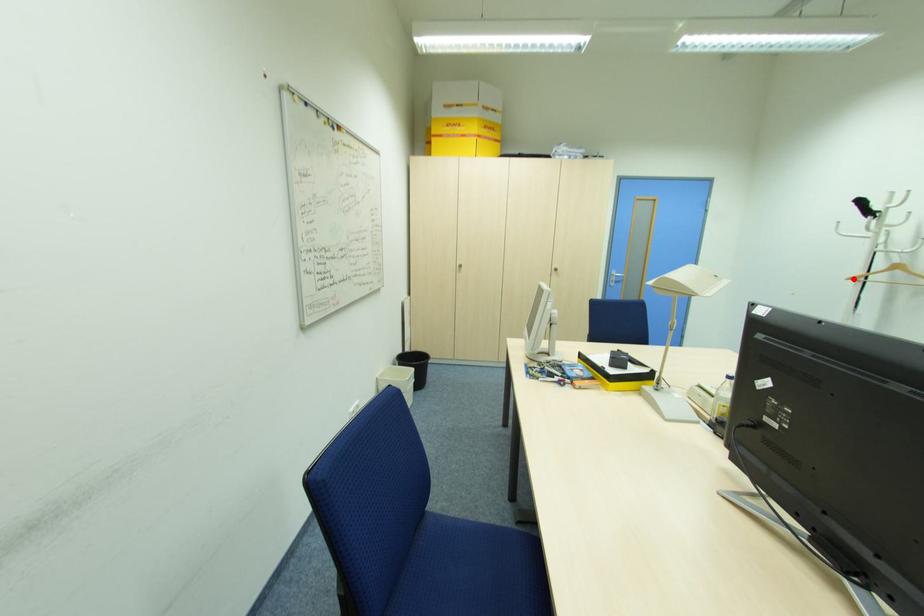
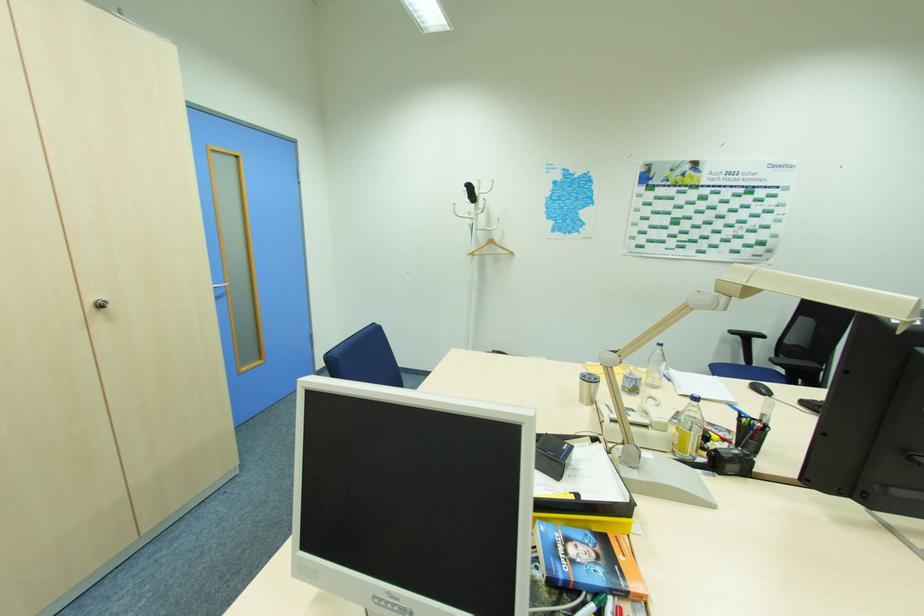
Question: I am providing you with two images of the same scene from different viewpoints. A red point is marked on the first image. Can you still see the location of the red point in image 2?

Choices:
 (A) Yes
 (B) No

Answer: (A)